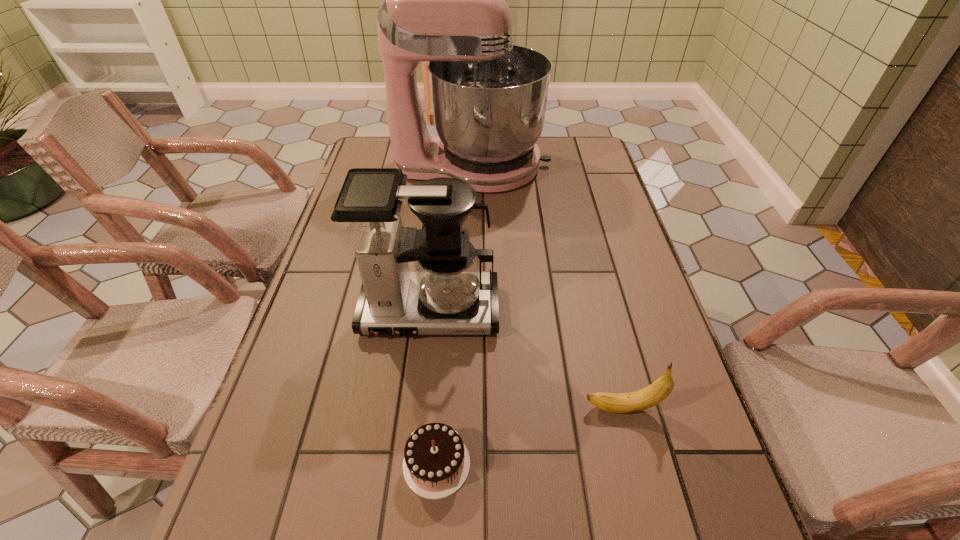
Locate an element on the screen. vacant space that satisfies the following two spatial constraints: 1. on the front-facing side of the tallest object; 2. on the front side of the shortest object is located at coordinates (466, 464).

What are the coordinates of `free space that satisfies the following two spatial constraints: 1. on the front-facing side of the farthest object; 2. at the front of the third nearest object where the controls are located` in the screenshot? It's located at (469, 312).

Find the location of a particular element. The width and height of the screenshot is (960, 540). vacant space that satisfies the following two spatial constraints: 1. at the front of the chocolate cake where the controls are located; 2. on the right side of the second farthest object is located at coordinates (413, 464).

You are a GUI agent. You are given a task and a screenshot of the screen. Output one action in this format:
    pyautogui.click(x=<x>, y=<y>)
    Task: Click on the free space that satisfies the following two spatial constraints: 1. on the front-facing side of the farthest object; 2. at the front of the coffee maker where the controls are located
    The image size is (960, 540).
    Given the screenshot: What is the action you would take?
    coord(469,312)

Image resolution: width=960 pixels, height=540 pixels. Identify the location of free location that satisfies the following two spatial constraints: 1. at the front of the third shortest object where the controls are located; 2. on the right side of the chocolate cake. (413, 464).